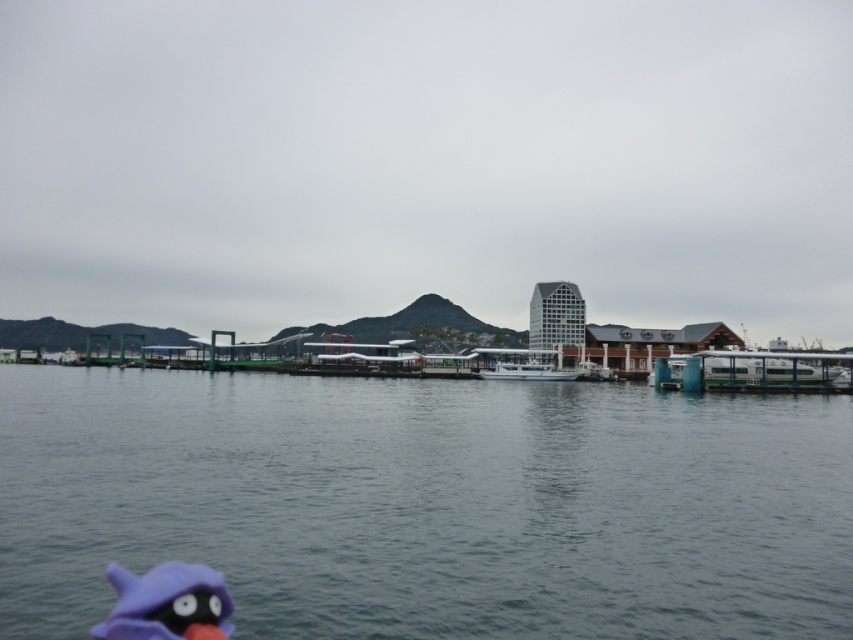
Question: Among these points, which one is nearest to the camera?

Choices:
 (A) (683, 387)
 (B) (520, 563)
 (C) (196, 593)
 (D) (541, 355)

Answer: (C)

Question: Can you confirm if white glossy boat at right is positioned below white glossy boat at center?

Choices:
 (A) yes
 (B) no

Answer: (B)

Question: Which object is positioned closest to the purple fabric toy at lower left?

Choices:
 (A) white glossy boat at right
 (B) white glossy boat at center
 (C) gray water at center

Answer: (C)

Question: Estimate the real-world distances between objects in this image. Which object is closer to the white glossy boat at right?

Choices:
 (A) gray water at center
 (B) purple fabric toy at lower left

Answer: (A)

Question: Is the position of purple fabric toy at lower left less distant than that of white glossy boat at center?

Choices:
 (A) no
 (B) yes

Answer: (B)

Question: Is purple fabric toy at lower left behind white glossy boat at center?

Choices:
 (A) no
 (B) yes

Answer: (A)